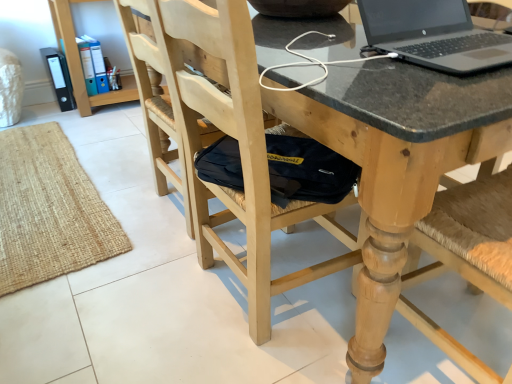
Question: From the image's perspective, is matte black folders at upper left located above or below black glossy laptop at upper right?

Choices:
 (A) below
 (B) above

Answer: (B)

Question: Considering their positions, is matte black folders at upper left located in front of or behind black glossy laptop at upper right?

Choices:
 (A) front
 (B) behind

Answer: (B)

Question: Which is nearer to the natural wood chair at center, which is the second chair in right-to-left order?

Choices:
 (A) black glossy laptop at upper right
 (B) wooden chair at center, the second chair in the left-to-right sequence
 (C) matte black folders at upper left

Answer: (B)

Question: Estimate the real-world distances between objects in this image. Which object is farther from the matte black folders at upper left?

Choices:
 (A) natural wood chair at center, which is the second chair in right-to-left order
 (B) black glossy laptop at upper right
 (C) wooden chair at center, the first chair when ordered from right to left

Answer: (C)